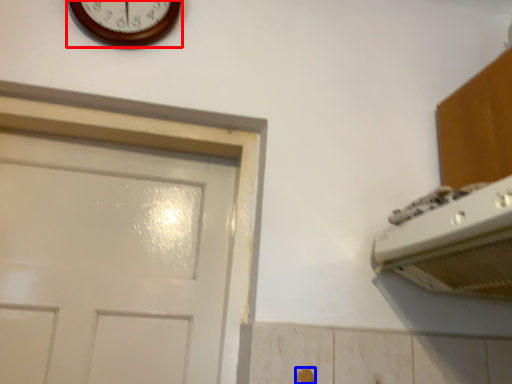
Question: Which object appears farthest to the camera in this image, wall clock (highlighted by a red box) or door handle (highlighted by a blue box)?

Choices:
 (A) wall clock
 (B) door handle

Answer: (A)